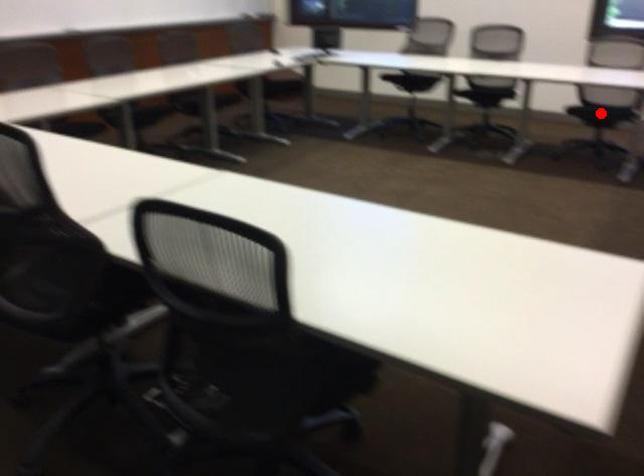
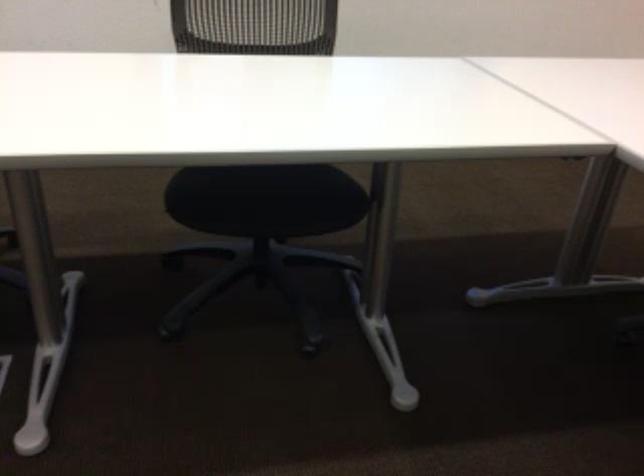
Question: I am providing you with two images of the same scene from different viewpoints. A red point is marked on the first image. Can you still see the location of the red point in image 2?

Choices:
 (A) Yes
 (B) No

Answer: (B)